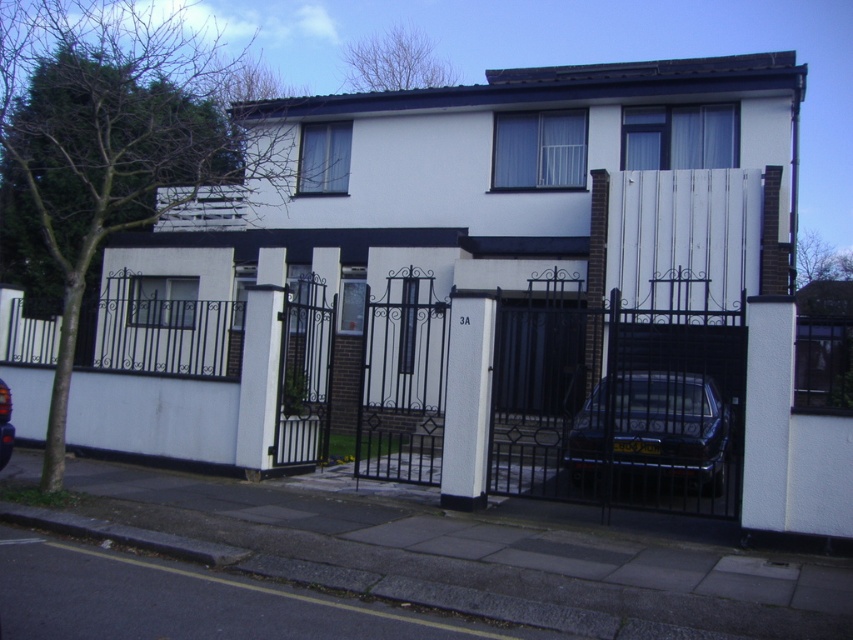
Which of these two, shiny dark blue sedan at center or shiny black car at center, stands taller?

Standing taller between the two is shiny dark blue sedan at center.

Between shiny dark blue sedan at center and shiny black car at center, which one has less height?

With less height is shiny black car at center.

Which is behind, point (706, 454) or point (6, 408)?

Positioned behind is point (706, 454).

At what (x,y) coordinates should I click in order to perform the action: click on shiny dark blue sedan at center. Please return your answer as a coordinate pair (x, y). This screenshot has width=853, height=640. Looking at the image, I should click on (653, 429).

Does black wrought iron gate at center appear on the right side of shiny black car at center?

Indeed, black wrought iron gate at center is positioned on the right side of shiny black car at center.

Based on the photo, which is more to the right, black wrought iron gate at center or shiny black car at center?

black wrought iron gate at center is more to the right.

This screenshot has width=853, height=640. Identify the location of black wrought iron gate at center. (619, 403).

In the scene shown: Is black wrought iron gate at center above shiny dark blue sedan at center?

Indeed, black wrought iron gate at center is positioned over shiny dark blue sedan at center.

Find the location of a particular element. The width and height of the screenshot is (853, 640). black wrought iron gate at center is located at coordinates (619, 403).

In order to click on black wrought iron gate at center in this screenshot , I will do `click(619, 403)`.